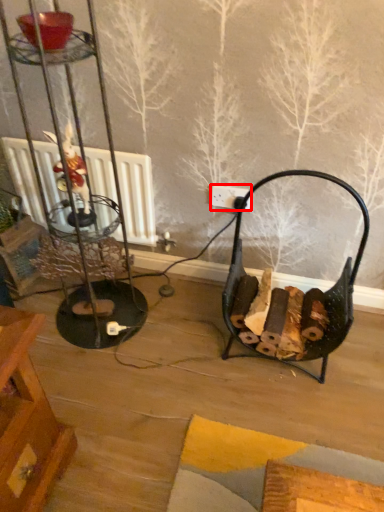
Question: From the image's perspective, where is electric outlet (annotated by the red box) located in relation to armchair in the image?

Choices:
 (A) below
 (B) above

Answer: (B)